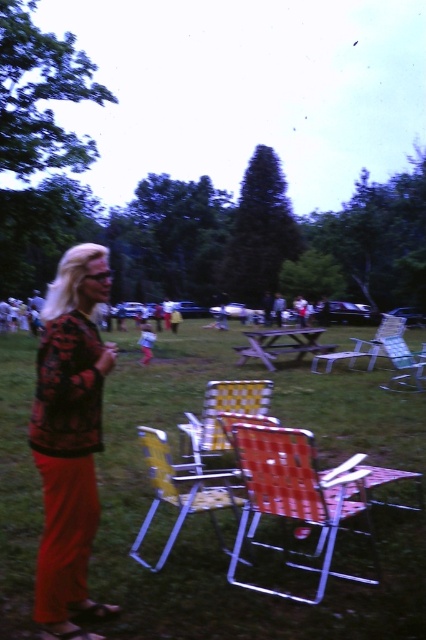
Who is more distant from viewer, [233,500] or [330,364]?

Positioned behind is point [330,364].

Who is lower down, metallic yellow chair at center or plastic folding chair at center?

Positioned lower is metallic yellow chair at center.

At what (x,y) coordinates should I click in order to perform the action: click on metallic yellow chair at center. Please return your answer as a coordinate pair (x, y). The height and width of the screenshot is (640, 426). Looking at the image, I should click on (180, 493).

This screenshot has height=640, width=426. Identify the location of metallic yellow chair at center. (180, 493).

Which is below, orange woven chair at center or yellow fabric chair at center?

Positioned lower is orange woven chair at center.

Is orange woven chair at center in front of yellow fabric chair at center?

That is True.

Is point (276, 436) behind point (152, 340)?

No.

This screenshot has height=640, width=426. Identify the location of orange woven chair at center. (296, 496).

Is matte black sweater at left shorter than yellow fabric chair at center?

No, matte black sweater at left is not shorter than yellow fabric chair at center.

Can you confirm if matte black sweater at left is positioned above yellow fabric chair at center?

No, matte black sweater at left is not above yellow fabric chair at center.

Who is more distant from viewer, (65, 328) or (150, 332)?

Point (150, 332)

Where is `matte black sweater at left`? matte black sweater at left is located at coordinates (69, 436).